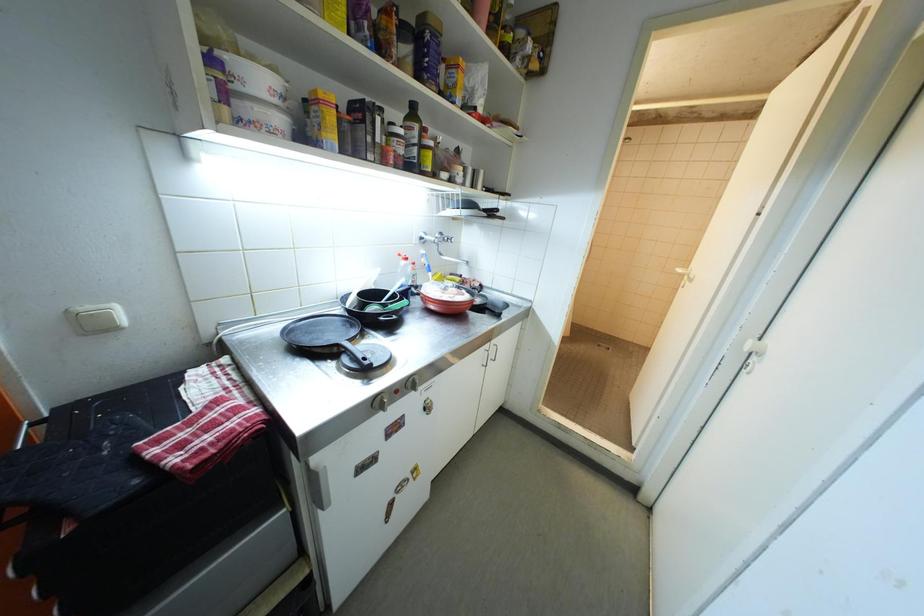
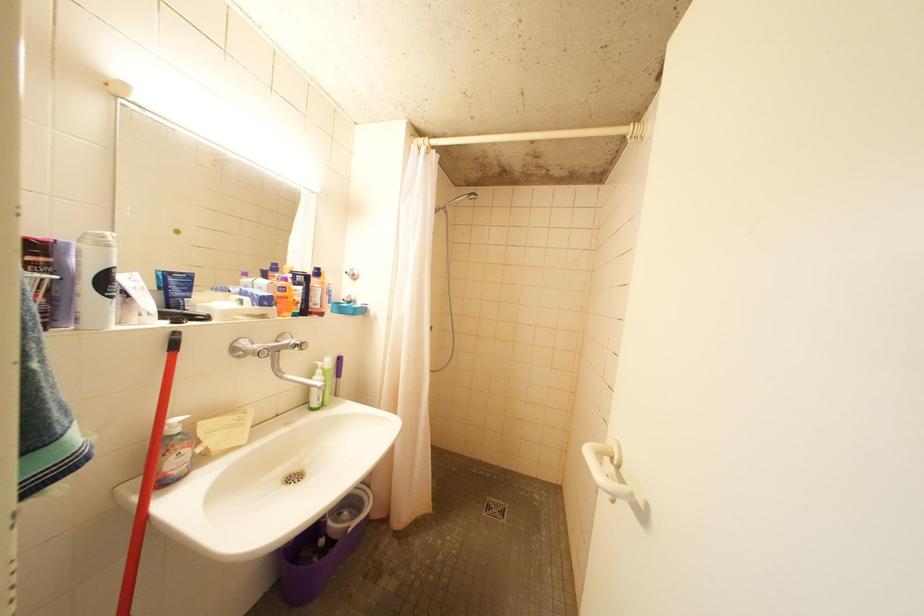
Which direction would the cameraman need to move to produce the second image?

The cameraman walked toward right, forward.